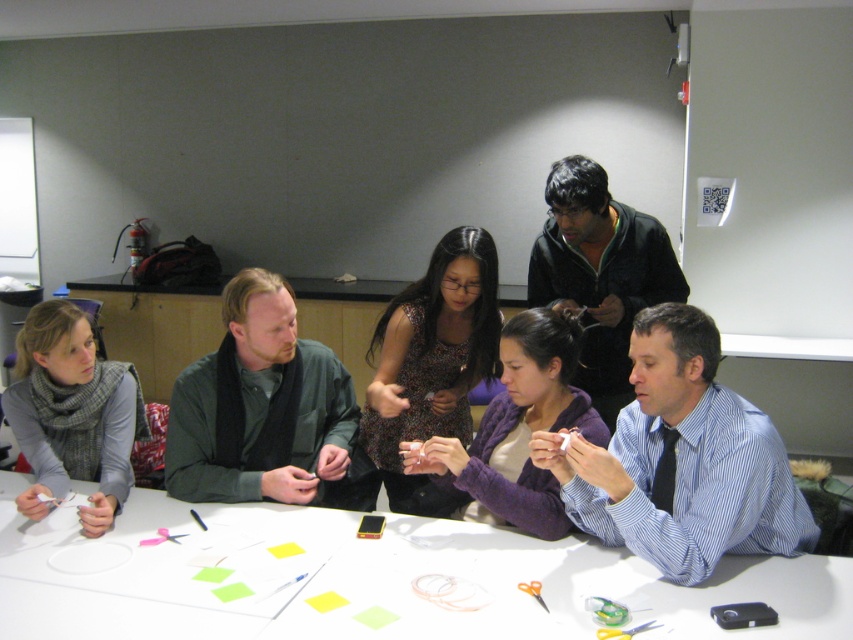
Looking at this image, you are navigating through a 3D model of the workshop scene. You need to move from point A to point B. Point A is at coordinates point [120,404] and point B is at coordinates point [519,362]. Which point is closer to you as you start your journey?

Point [120,404] is closer to you than point [519,362] because it is further to the viewer according to the description.

In the scene shown: You are a photographer positioned at the camera location. You want to capture a closeup shot of the gray wool scarf at left without moving the camera. Is it possible to focus on the scarf if your camera has a maximum focus distance of 1.7 meters?

The gray wool scarf at left is 1.85 meters away from the camera, which exceeds the maximum focus distance of 1.7 meters. Therefore, the camera cannot focus on the scarf without moving closer.

You are a participant in the workshop and need to place a small object on the table. Which object, the white paper at center or the blue striped shirt at center, is closer to the edge of the table?

The white paper at center is shorter than the blue striped shirt at center, so the white paper at center is closer to the edge of the table.